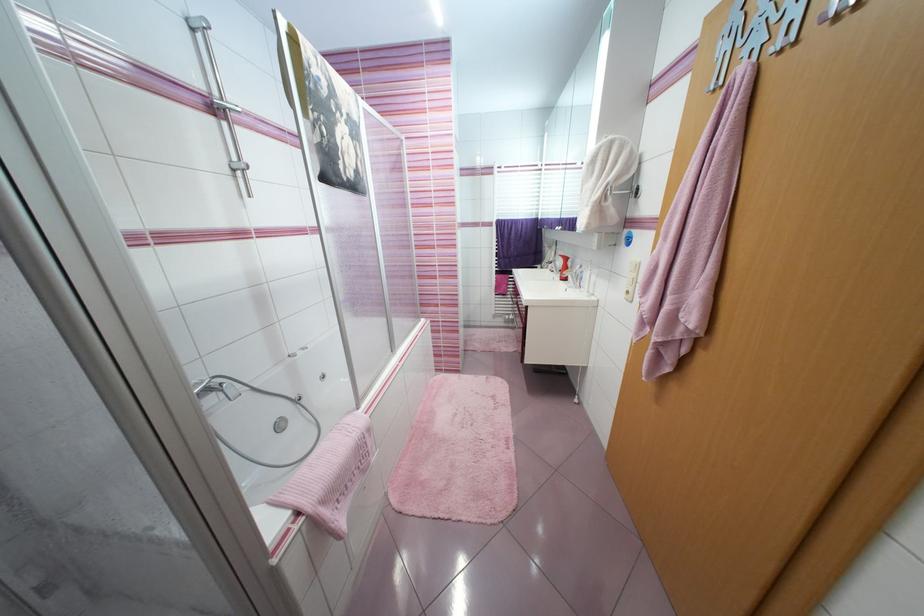
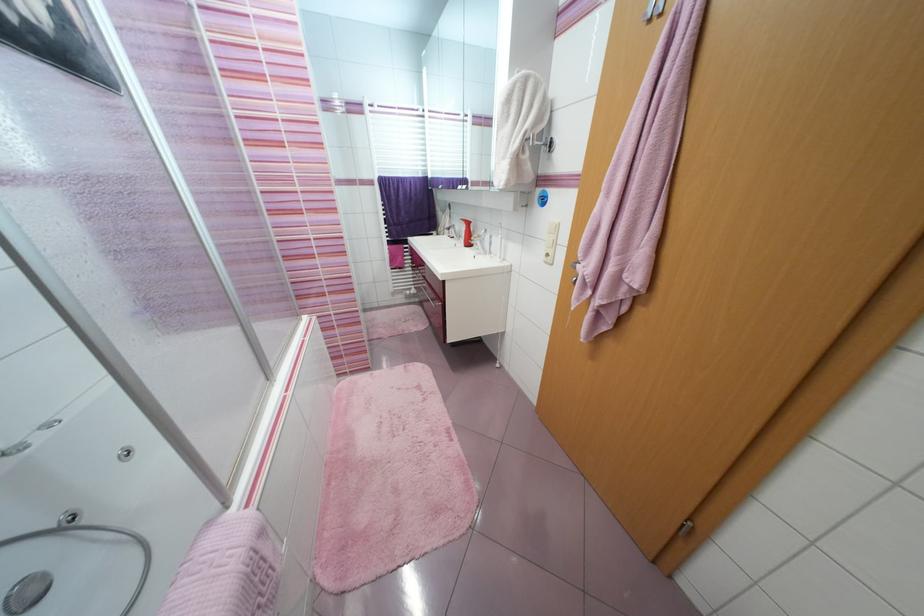
Question: Which direction would the cameraman need to move to produce the second image? Reply with the corresponding letter.

Choices:
 (A) Left
 (B) Right
 (C) Forward
 (D) Backward

Answer: (C)